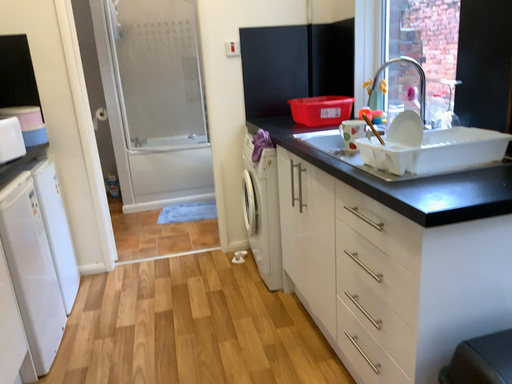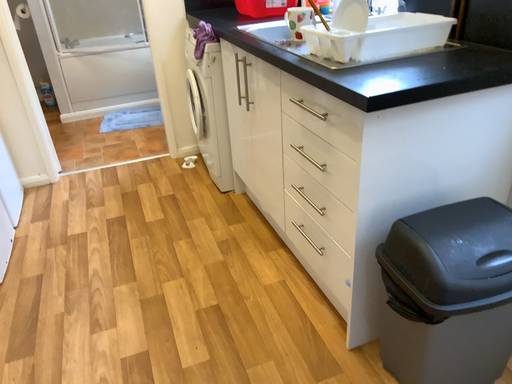
Question: Which way did the camera rotate in the video?

Choices:
 (A) rotated upward
 (B) rotated downward

Answer: (B)